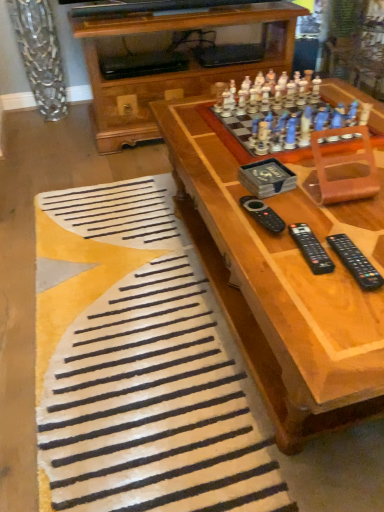
This screenshot has height=512, width=384. I want to click on free spot in front of black plastic remote at center, which is counted as the 1th remote, starting from the left, so click(273, 259).